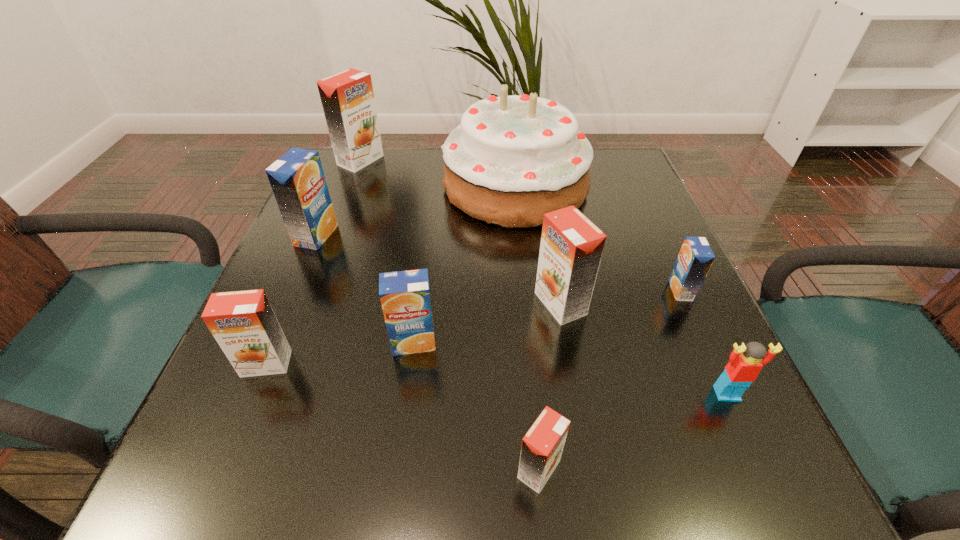
Image resolution: width=960 pixels, height=540 pixels. What are the coordinates of `free point between the second blue orange_juice from right to left and the eighth farthest object` in the screenshot? It's located at (570, 368).

Find the location of `vacant space in between the second smallest blue orange_juice and the nearest orange orange juice`. vacant space in between the second smallest blue orange_juice and the nearest orange orange juice is located at coordinates (476, 406).

At what (x,y) coordinates should I click in order to perform the action: click on free spot between the second nearest blue orange_juice and the second farthest orange juice. Please return your answer as a coordinate pair (x, y). This screenshot has width=960, height=540. Looking at the image, I should click on (498, 263).

Locate which object is the fourth closest to the rightmost blue orange_juice. Please provide its 2D coordinates. Your answer should be formatted as a tuple, i.e. [(x, y)], where the tuple contains the x and y coordinates of a point satisfying the conditions above.

[(542, 446)]

At what (x,y) coordinates should I click in order to perform the action: click on object that stands as the second closest to the rightmost orange juice. Please return your answer as a coordinate pair (x, y). Looking at the image, I should click on (742, 370).

Image resolution: width=960 pixels, height=540 pixels. Identify the location of orange juice that is the sixth closest to the second smallest orange orange juice. (695, 258).

Identify which orange juice is located as the fourth nearest to the leftmost blue orange_juice. Please provide its 2D coordinates. Your answer should be formatted as a tuple, i.e. [(x, y)], where the tuple contains the x and y coordinates of a point satisfying the conditions above.

[(571, 248)]

Choose which orange orange juice is the second nearest neighbor to the second farthest blue orange_juice. Please provide its 2D coordinates. Your answer should be formatted as a tuple, i.e. [(x, y)], where the tuple contains the x and y coordinates of a point satisfying the conditions above.

[(542, 446)]

Where is `orange orange juice that can be found as the second closest to the fourth orange juice from right to left`? The width and height of the screenshot is (960, 540). orange orange juice that can be found as the second closest to the fourth orange juice from right to left is located at coordinates (571, 248).

Find the location of a particular element. the closest blue orange_juice to the sixth nearest orange juice is located at coordinates (405, 295).